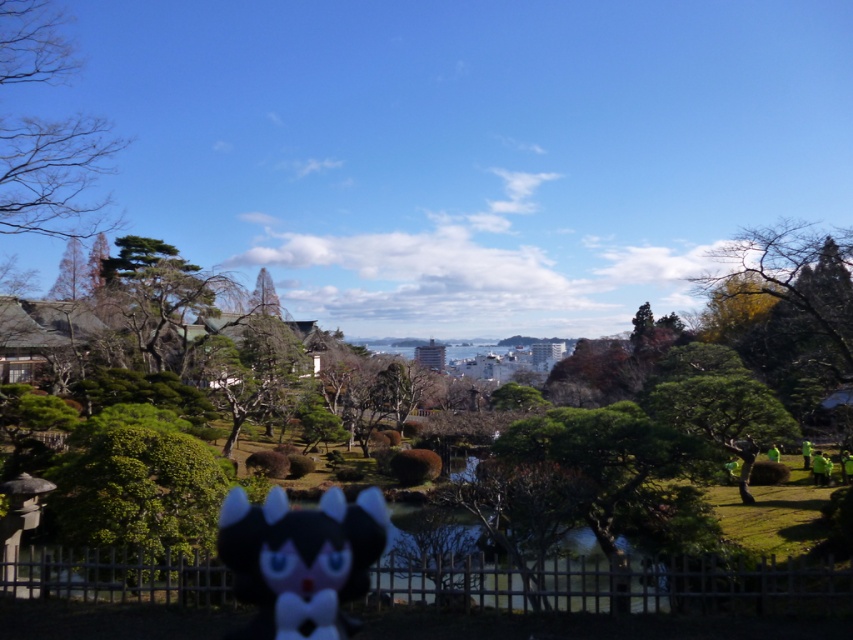
Does green leafy tree at right have a lesser height compared to black plush toy at center?

In fact, green leafy tree at right may be taller than black plush toy at center.

Does green leafy tree at right appear over black plush toy at center?

Indeed, green leafy tree at right is positioned over black plush toy at center.

Measure the distance between point (833,308) and camera.

The distance of point (833,308) from camera is 22.35 meters.

Where is `green leafy tree at right`? The width and height of the screenshot is (853, 640). green leafy tree at right is located at coordinates tap(788, 316).